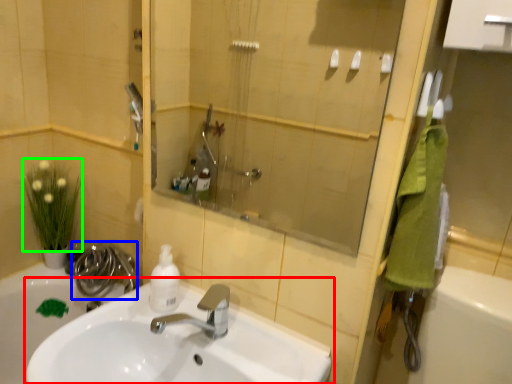
Question: Which is nearer to the sink (highlighted by a red box)? plumbing fixture (highlighted by a blue box) or flower (highlighted by a green box).

Choices:
 (A) plumbing fixture
 (B) flower

Answer: (A)